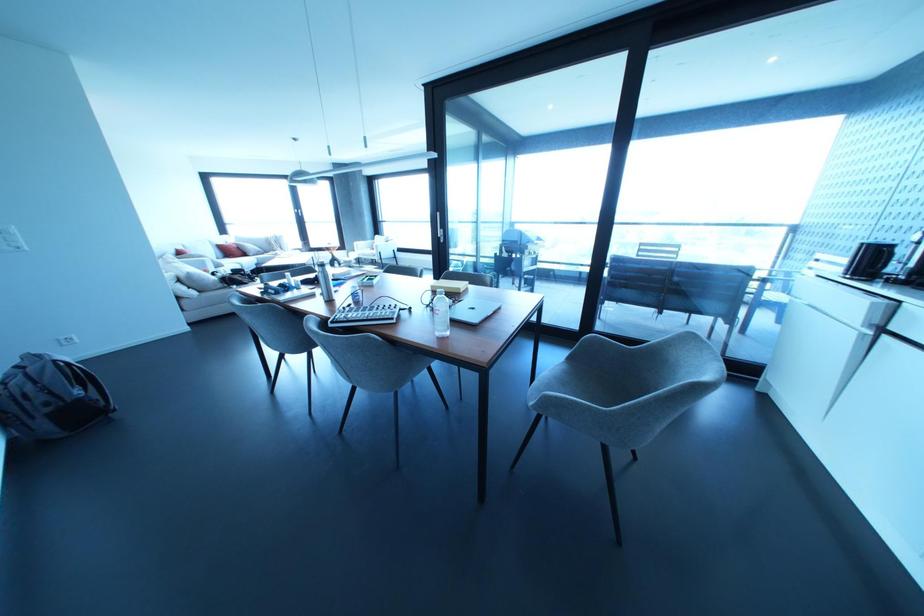
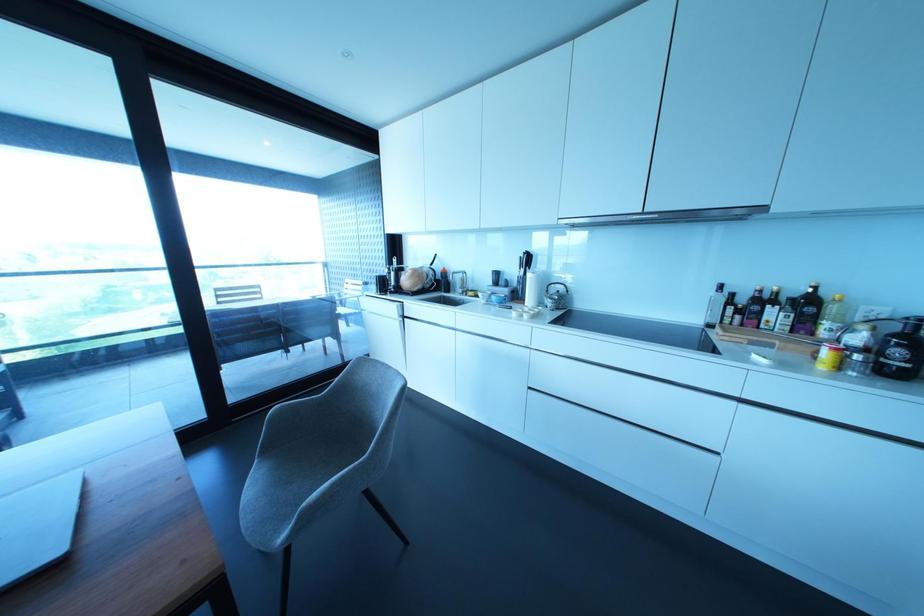
Question: The first image is from the beginning of the video and the second image is from the end. How did the camera likely rotate when shooting the video?

Choices:
 (A) Left
 (B) Right
 (C) Up
 (D) Down

Answer: (B)